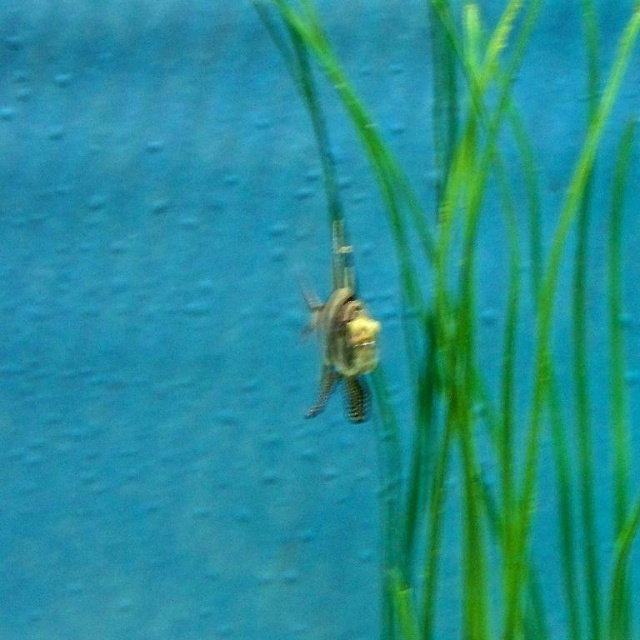
Can you confirm if green leafy grass at center is wider than translucent plastic insect at center?

Correct, the width of green leafy grass at center exceeds that of translucent plastic insect at center.

Is point (509, 310) behind point (307, 305)?

No, it is in front of (307, 305).

Between point (493, 173) and point (362, 365), which one is positioned in front?

Point (362, 365)

The image size is (640, 640). I want to click on green leafy grass at center, so click(499, 337).